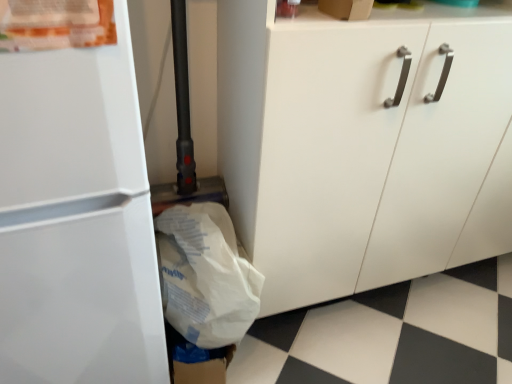
Question: From the image's perspective, is white matte cabinet at center located above or below white paper grocery bag at lower left?

Choices:
 (A) below
 (B) above

Answer: (B)

Question: In terms of height, does white matte cabinet at center look taller or shorter compared to white paper grocery bag at lower left?

Choices:
 (A) tall
 (B) short

Answer: (A)

Question: Based on their relative distances, which object is nearer to the white paper grocery bag at lower left?

Choices:
 (A) white matte cabinet at center
 (B) white glossy refrigerator at left

Answer: (B)

Question: Estimate the real-world distances between objects in this image. Which object is farther from the white glossy refrigerator at left?

Choices:
 (A) white matte cabinet at center
 (B) white paper grocery bag at lower left

Answer: (A)